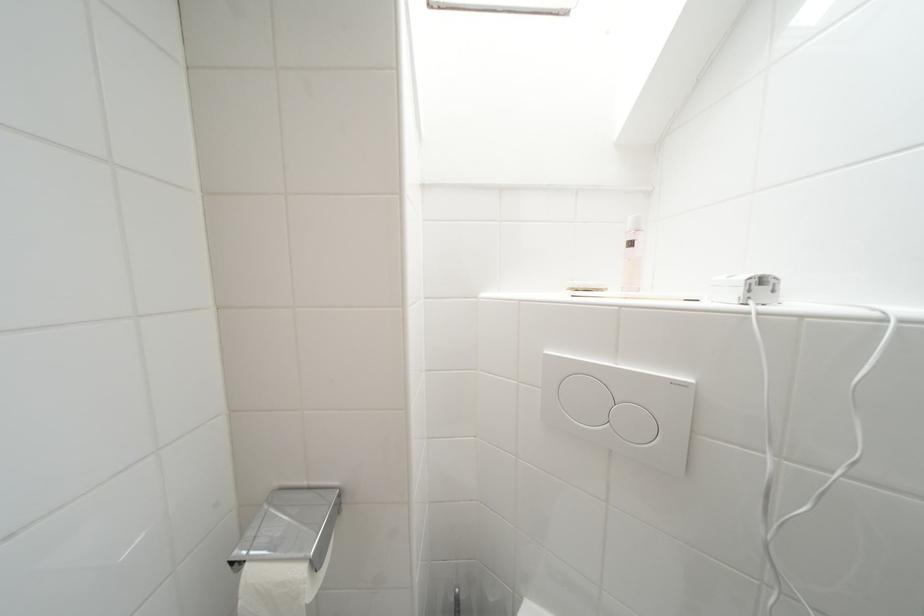
Find where to lift the toilet paper holder cover. Please return your answer as a coordinate pair (x, y).

(290, 525)